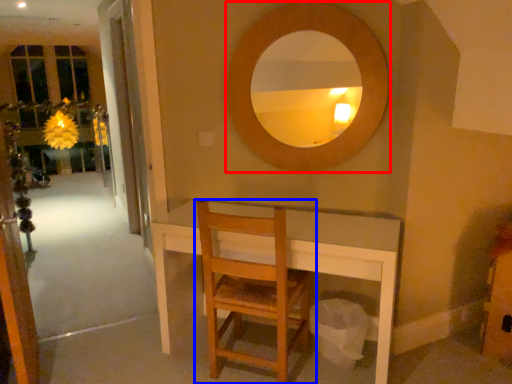
Question: Which object is further to the camera taking this photo, mirror (highlighted by a red box) or chair (highlighted by a blue box)?

Choices:
 (A) mirror
 (B) chair

Answer: (A)